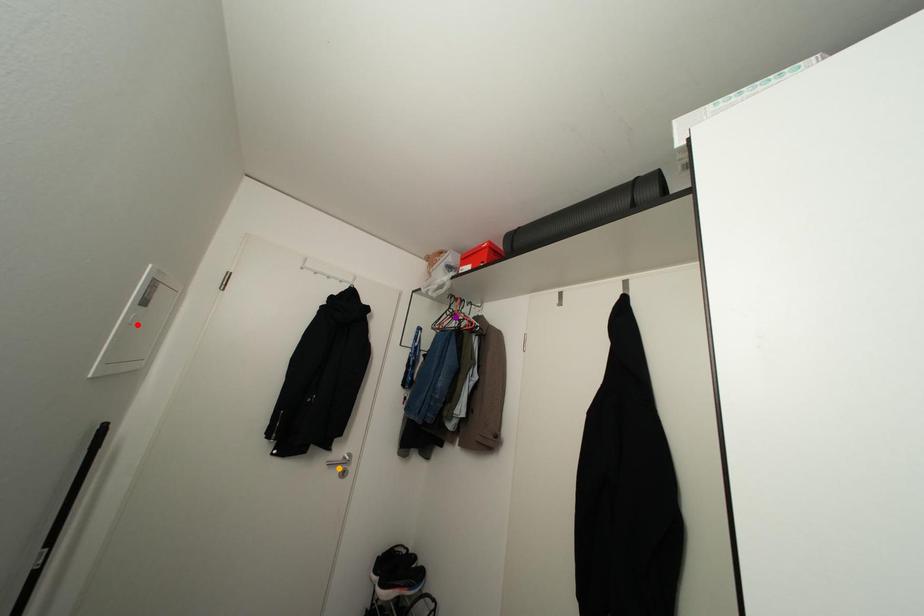
Order these from nearest to farthest:
orange point | red point | purple point

red point < orange point < purple point